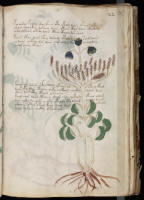
Find the location of a particular element. bible is located at coordinates (39, 152).